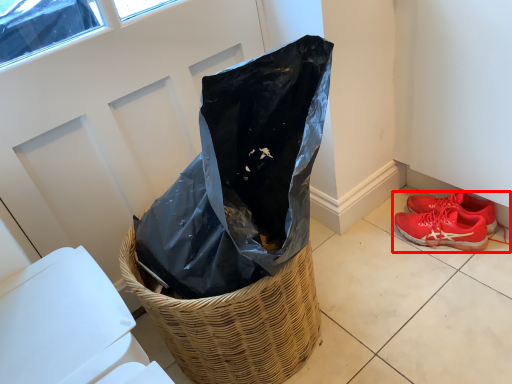
Question: From the image, what is the correct spatial relationship of footwear (annotated by the red box) in relation to basket?

Choices:
 (A) right
 (B) left

Answer: (A)